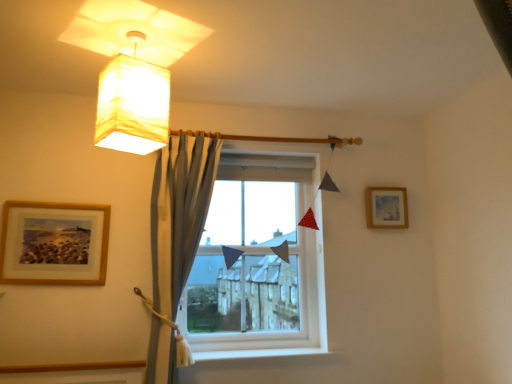
Locate an element on the screen. vacant region above matte yellow fabric lampshade at upper left (from a real-world perspective) is located at coordinates (138, 34).